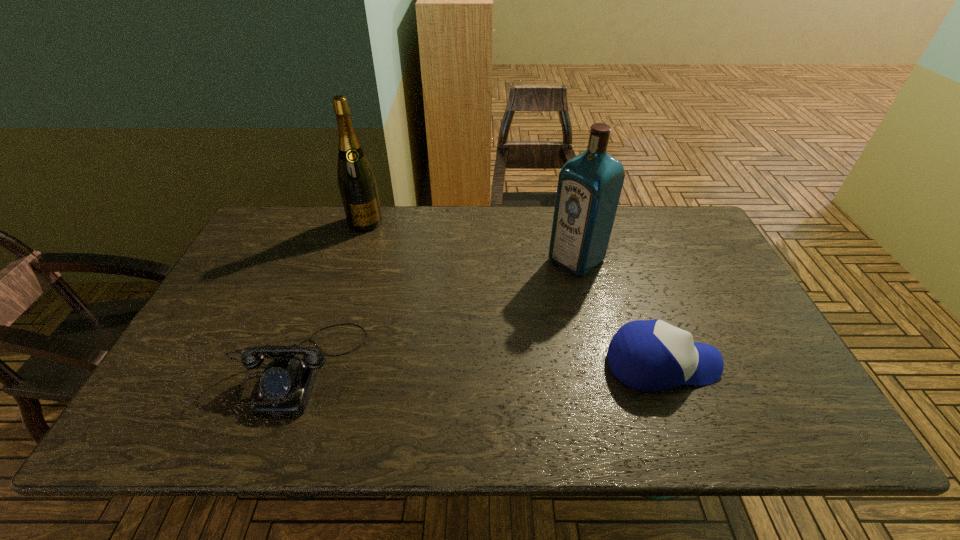
Find the location of a particular element. This screenshot has width=960, height=540. free space at the left edge is located at coordinates (286, 260).

Locate an element on the screen. free space at the right edge of the desktop is located at coordinates (711, 279).

The width and height of the screenshot is (960, 540). Find the location of `vacant space at the far left corner of the desktop`. vacant space at the far left corner of the desktop is located at coordinates (289, 248).

At what (x,y) coordinates should I click in order to perform the action: click on empty location between the liquor and the baseball cap. Please return your answer as a coordinate pair (x, y). The width and height of the screenshot is (960, 540). Looking at the image, I should click on (619, 312).

This screenshot has height=540, width=960. In order to click on vacant point located between the second farthest object and the baseball cap in this screenshot , I will do `click(619, 312)`.

You are a GUI agent. You are given a task and a screenshot of the screen. Output one action in this format:
    pyautogui.click(x=<x>, y=<y>)
    Task: Click on the free space that is in between the liquor and the telephone
    
    Given the screenshot: What is the action you would take?
    pyautogui.click(x=438, y=313)

You are a GUI agent. You are given a task and a screenshot of the screen. Output one action in this format:
    pyautogui.click(x=<x>, y=<y>)
    Task: Click on the empty space that is in between the telephone and the farthest object
    This screenshot has width=960, height=540.
    Given the screenshot: What is the action you would take?
    pyautogui.click(x=332, y=294)

Find the location of a particular element. This screenshot has height=540, width=960. vacant space that's between the telephone and the baseball cap is located at coordinates (481, 365).

The image size is (960, 540). I want to click on blank region between the farthest object and the telephone, so click(x=332, y=294).

Identify the location of vacant space that is in between the liquor and the wine bottle. Image resolution: width=960 pixels, height=540 pixels. (470, 241).